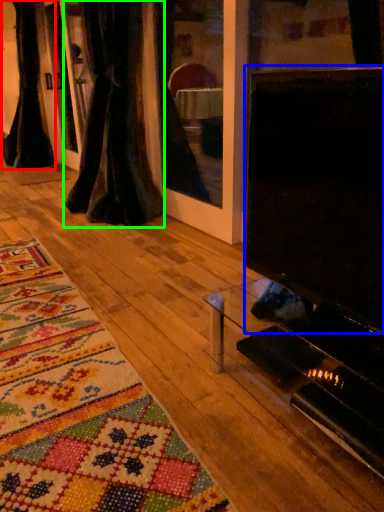
Question: Considering the real-world distances, which object is closest to curtain (highlighted by a red box)? screen (highlighted by a blue box) or curtain (highlighted by a green box).

Choices:
 (A) screen
 (B) curtain

Answer: (B)